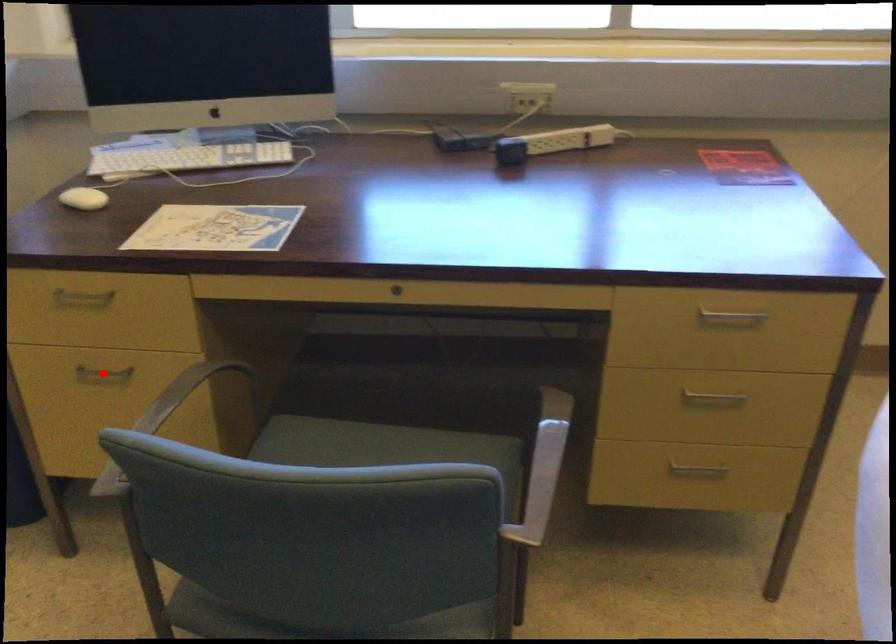
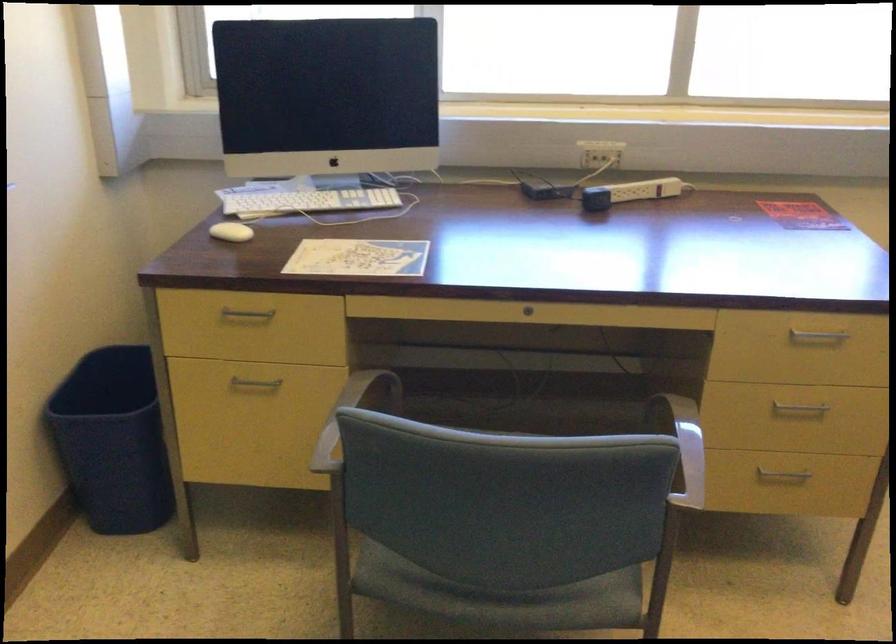
Question: I am providing you with two images of the same scene from different viewpoints. In image1, a red point is highlighted. Considering the same 3D point in image2, which of the following is correct?

Choices:
 (A) It is closer
 (B) It is farther

Answer: (B)